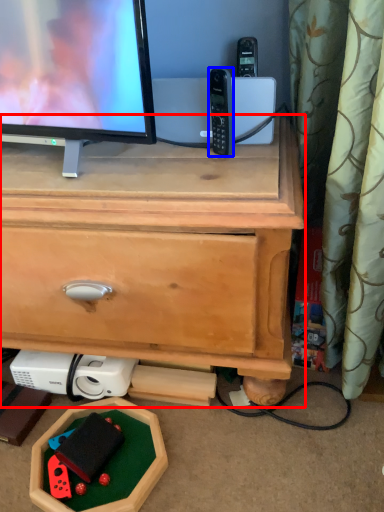
Question: Which point is further to the camera, chest of drawers (highlighted by a red box) or gadget (highlighted by a blue box)?

Choices:
 (A) chest of drawers
 (B) gadget

Answer: (B)